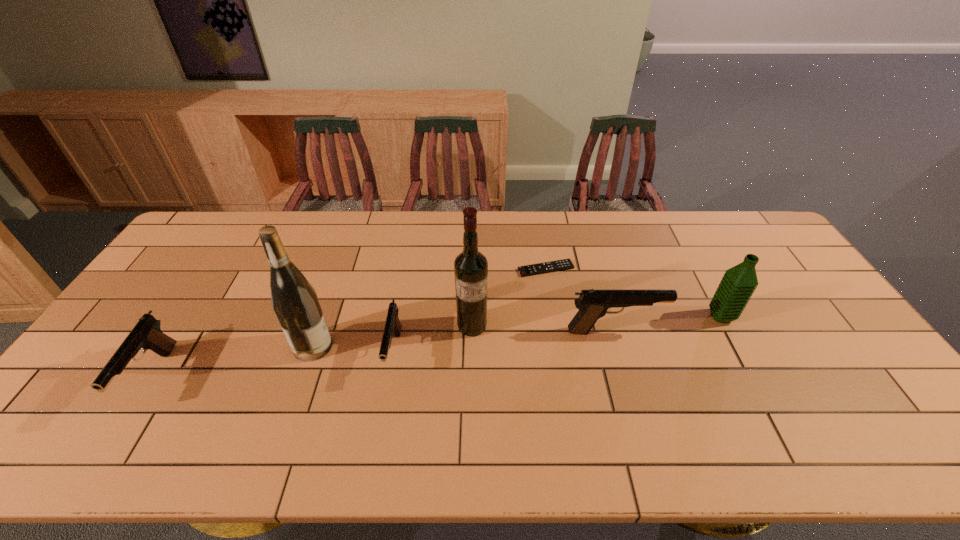
Identify the location of the third shortest object. The height and width of the screenshot is (540, 960). (146, 334).

Image resolution: width=960 pixels, height=540 pixels. In order to click on the leftmost object in this screenshot , I will do `click(146, 334)`.

Where is `the shortest pistol`? Image resolution: width=960 pixels, height=540 pixels. the shortest pistol is located at coordinates (393, 326).

What are the coordinates of `the fifth object from right to left` in the screenshot? It's located at (393, 326).

The height and width of the screenshot is (540, 960). What are the coordinates of `the rightmost pistol` in the screenshot? It's located at (593, 304).

The width and height of the screenshot is (960, 540). Find the location of `the sixth object from right to left`. the sixth object from right to left is located at coordinates (295, 303).

Identify the location of the shortest object. (565, 264).

At what (x,y) coordinates should I click in order to perform the action: click on the farthest object. Please return your answer as a coordinate pair (x, y). The width and height of the screenshot is (960, 540). Looking at the image, I should click on (565, 264).

This screenshot has width=960, height=540. What are the coordinates of `the third tallest object` in the screenshot? It's located at (738, 284).

The height and width of the screenshot is (540, 960). Identify the location of water bottle. (738, 284).